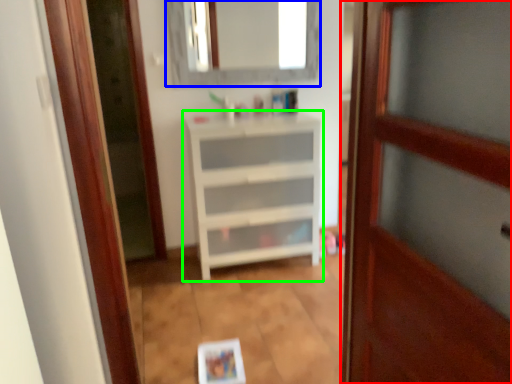
Question: Which is nearer to the door (highlighted by a red box)? mirror (highlighted by a blue box) or chest of drawers (highlighted by a green box).

Choices:
 (A) mirror
 (B) chest of drawers

Answer: (B)